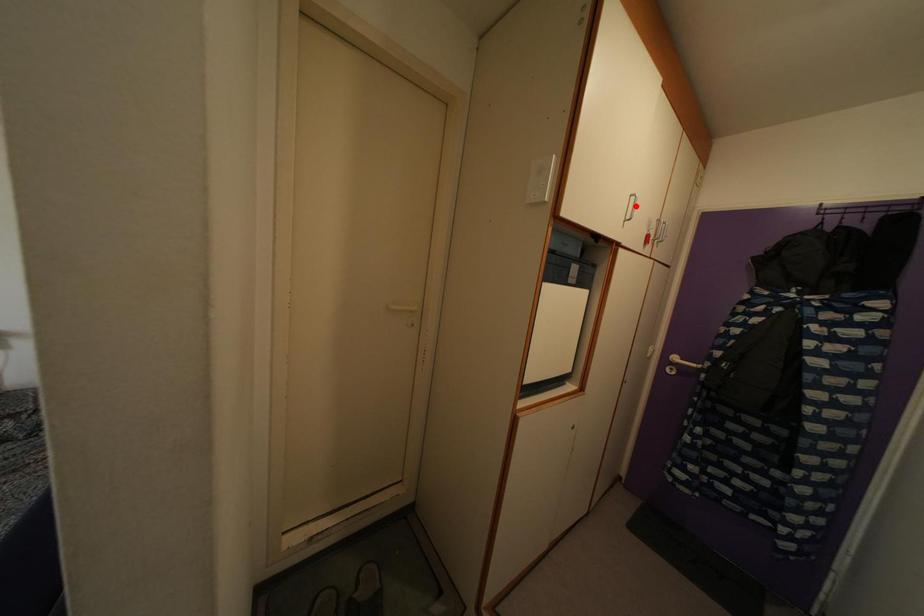
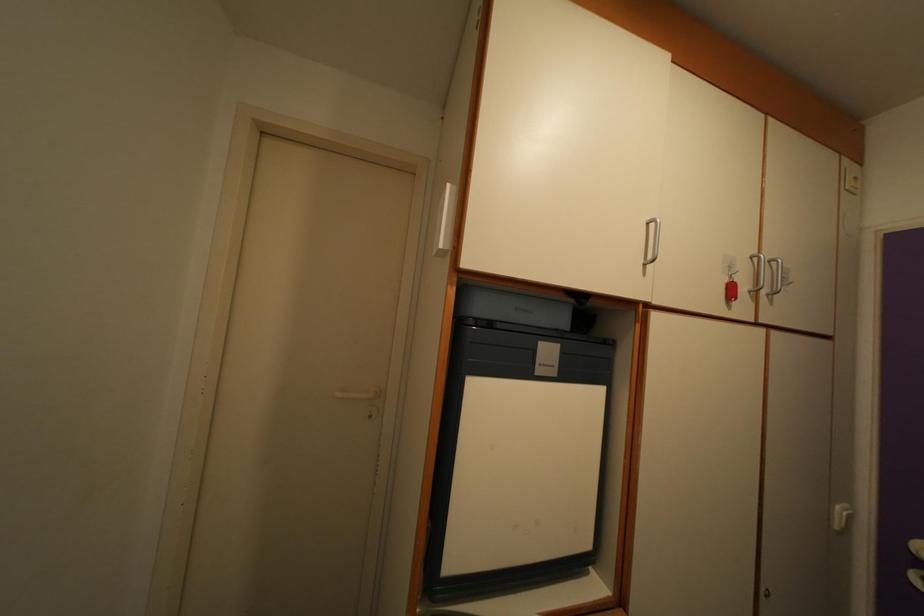
Locate, in the second image, the point that corresponds to the highlighted location in the first image.

(654, 233)